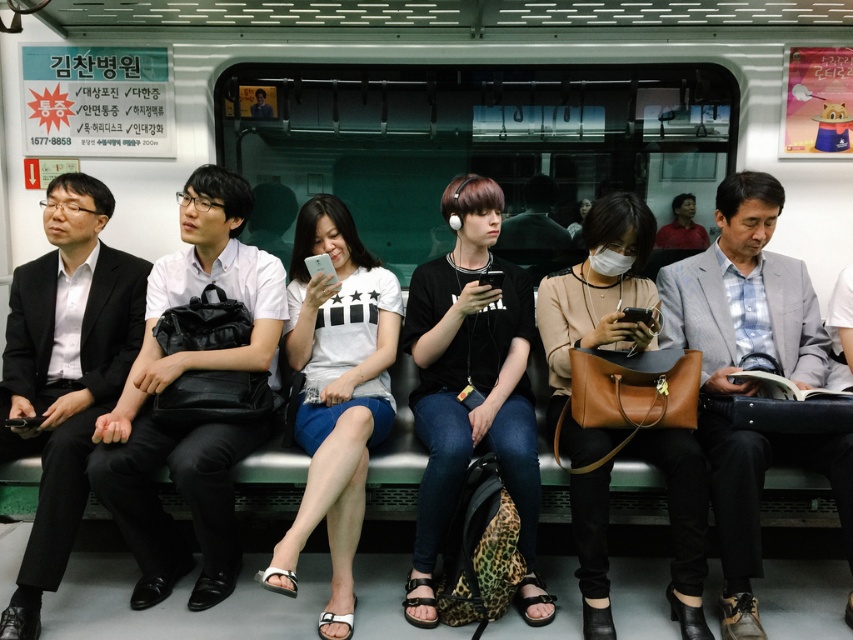
Based on the photo, you are a photographer standing in the subway train. You want to take a photo of the matte black backpack at left and the matte black shirt at center without any obstruction. Given that your camera has a maximum focus range of 26 inches, will you be able to capture both objects clearly in the same frame?

The matte black backpack at left and matte black shirt at center are 26.70 inches apart from each other. Since the distance between them exceeds the camera maximum focus range of 26 inches, you won not be able to capture both objects clearly in the same frame.

You are a photographer standing in the subway train and want to take a photo of the matte black backpack at left and the matte black shirt at center. Since the backpack is in front, will the shirt be visible in the photo?

The matte black backpack at left is in front of the matte black shirt at center, so the shirt may be partially or fully obscured depending on the backpack position. Adjust your angle to ensure both are visible.

In the scene shown: You are a photographer trying to capture a candid shot of the passengers on the subway. You have a camera with a 1.2 meter wide lens. The gray fabric suit at right and the matte black shirt at center are seated next to each other. Can you fit both of them in your shot without cropping either of their entire bodies?

The gray fabric suit at right is wider than the matte black shirt at center. Since the total width required would be more than 1.2 meters, the camera lens cannot capture both without cropping.